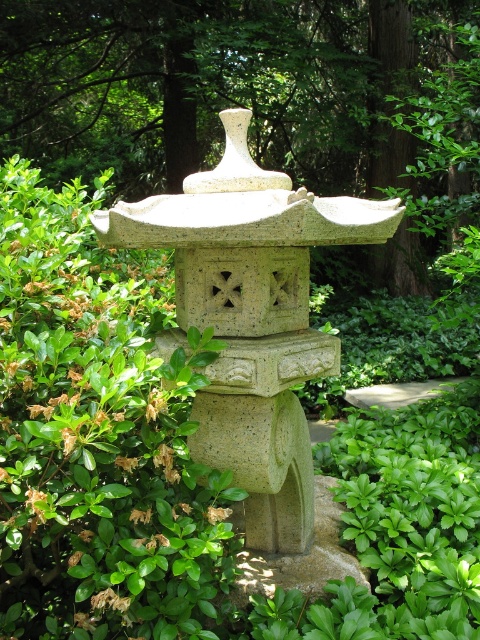
You are a gardener who wants to place a new small potted plant between the green leafy bush at center and the gray stone statue at center. Since the statue is taller, where should you place the potted plant to ensure it gets enough sunlight?

Since the green leafy bush at center is shorter than the gray stone statue at center, you should place the potted plant near the green leafy bush at center to avoid the shadow cast by the taller statue.

You are a gardener planning to place a new decorative item in the garden. You have a small potted plant that needs space. Looking at the image, which object between the green leafy bush at center and the gray stone statue at center would you choose to place the potted plant near, considering space availability?

The green leafy bush at center occupies less space than the gray stone statue at center, so placing the potted plant near the green leafy bush at center would be better due to the available space.